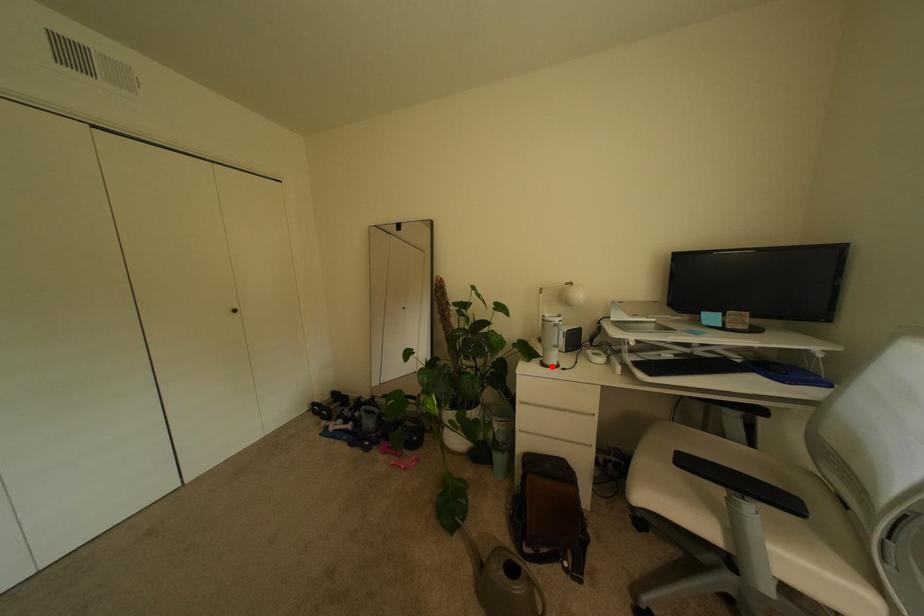
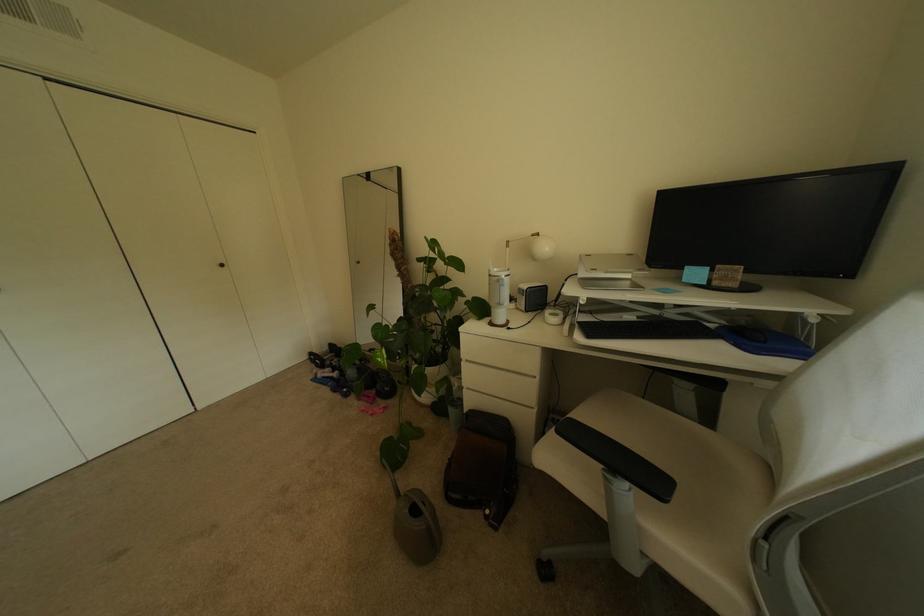
In the second image, find the point that corresponds to the highlighted location in the first image.

(500, 325)